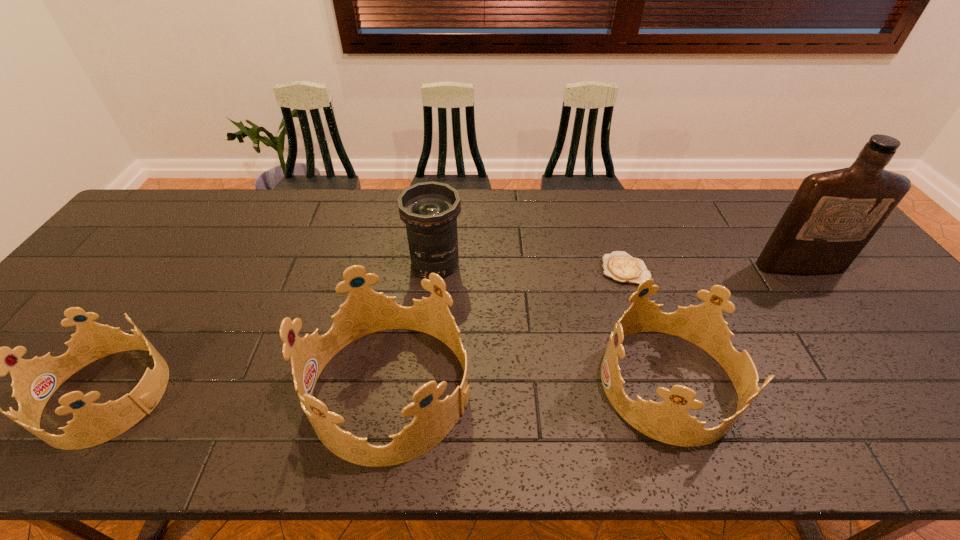
This screenshot has width=960, height=540. Identify the location of free space located 0.310m on the front-facing side of the second tiara from left to right. (173, 389).

This screenshot has width=960, height=540. I want to click on vacant space located on the front-facing side of the second tiara from left to right, so click(x=281, y=389).

Find the location of `vacant space positioned on the front-facing side of the rightmost tiara`. vacant space positioned on the front-facing side of the rightmost tiara is located at coordinates (477, 383).

Locate an element on the screen. This screenshot has height=540, width=960. vacant space located on the front-facing side of the rightmost tiara is located at coordinates (491, 383).

Find the location of a particular element. vacant region located 0.240m on the front-facing side of the rightmost tiara is located at coordinates (495, 383).

Identify the location of vacant space located 0.190m on the right of the quiche. This screenshot has height=540, width=960. (716, 269).

At what (x,y) coordinates should I click in order to perform the action: click on vacant space situated 0.280m on the label side of the liquor. Please return your answer as a coordinate pair (x, y). This screenshot has width=960, height=540. Looking at the image, I should click on (870, 361).

This screenshot has height=540, width=960. Identify the location of free space located on the right of the telephoto lens. (488, 264).

You are a GUI agent. You are given a task and a screenshot of the screen. Output one action in this format:
    pyautogui.click(x=<x>, y=<y>)
    Task: Click on the object located at the left edge
    The width and height of the screenshot is (960, 540).
    Given the screenshot: What is the action you would take?
    pyautogui.click(x=34, y=381)

In order to click on object that is at the right edge in this screenshot , I will do (x=834, y=214).